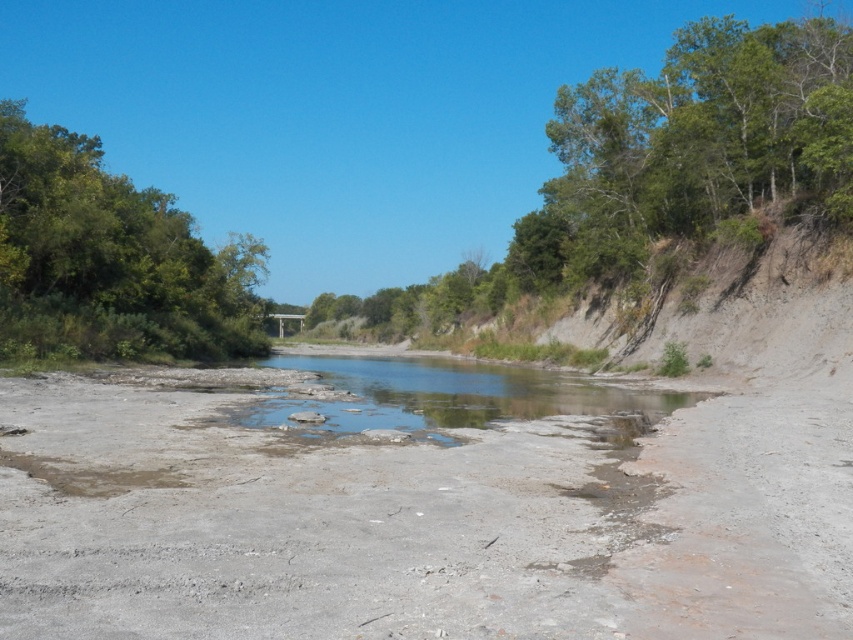
Question: Among these objects, which one is farthest from the camera?

Choices:
 (A) green leafy trees at upper right
 (B) clear water at center

Answer: (A)

Question: Does green leafy tree at upper left have a greater width compared to clear water at center?

Choices:
 (A) no
 (B) yes

Answer: (B)

Question: Considering the real-world distances, which object is farthest from the clear water at center?

Choices:
 (A) green leafy trees at upper right
 (B) green leafy tree at upper left

Answer: (A)

Question: Does green leafy trees at upper right have a lesser width compared to clear water at center?

Choices:
 (A) no
 (B) yes

Answer: (A)

Question: Which object is positioned farthest from the clear water at center?

Choices:
 (A) green leafy trees at upper right
 (B) green leafy tree at upper left

Answer: (A)

Question: Does green leafy trees at upper right have a smaller size compared to clear water at center?

Choices:
 (A) yes
 (B) no

Answer: (B)